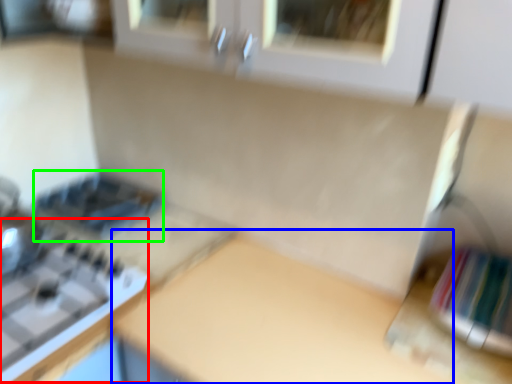
Question: Based on their relative distances, which object is farther from gas stove (highlighted by a red box)? Choose from counter top (highlighted by a blue box) and appliance (highlighted by a green box).

Choices:
 (A) counter top
 (B) appliance

Answer: (B)